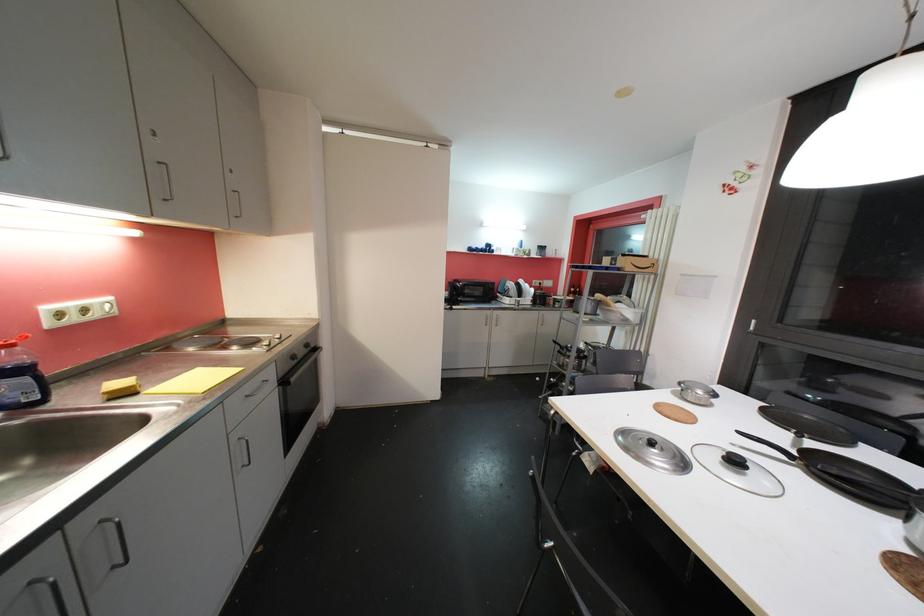
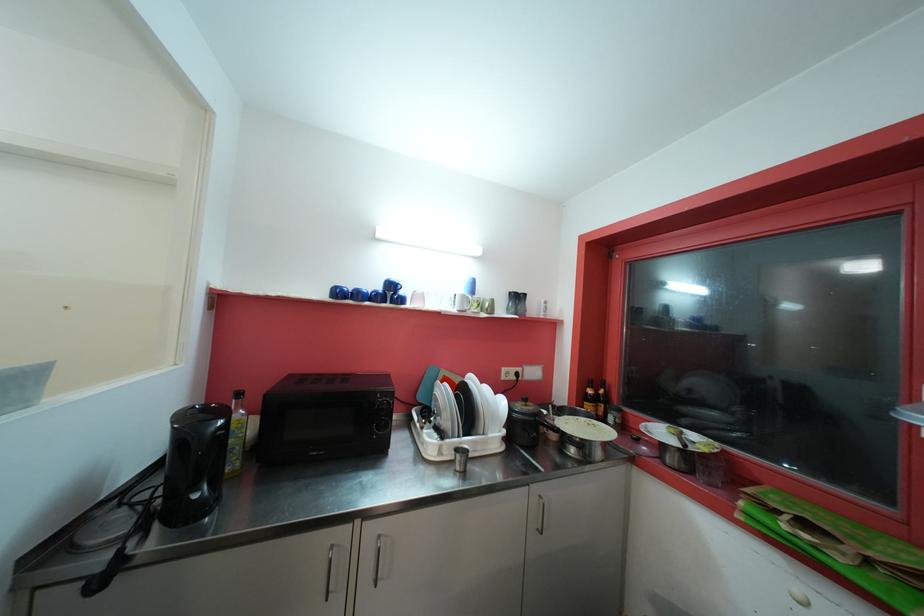
In the second image, find the point that corresponds to pixel 493 248 in the first image.

(396, 288)